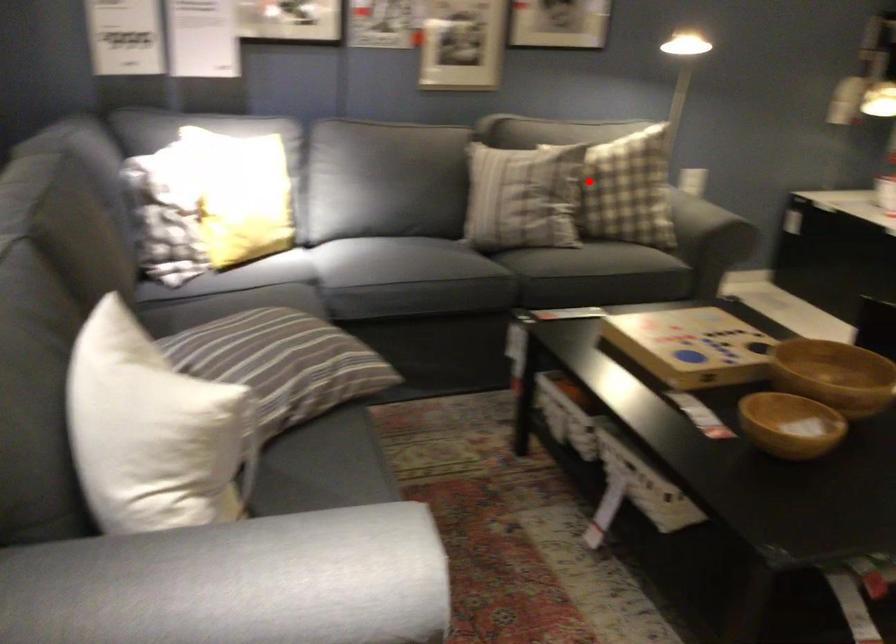
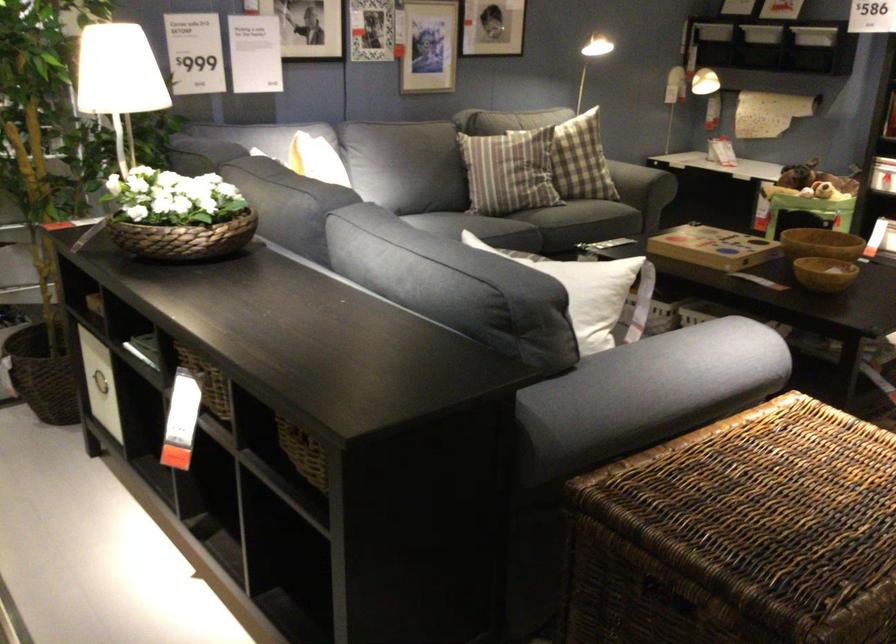
In the second image, find the point that corresponds to the highlighted location in the first image.

(581, 160)